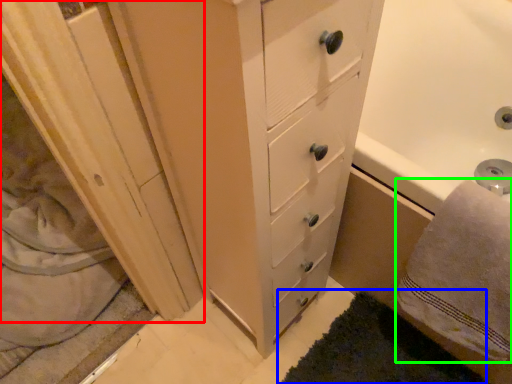
Question: Which object is the closest to the screen door (highlighted by a red box)? Choose among these: bath mat (highlighted by a blue box) or bath towel (highlighted by a green box).

Choices:
 (A) bath mat
 (B) bath towel

Answer: (A)